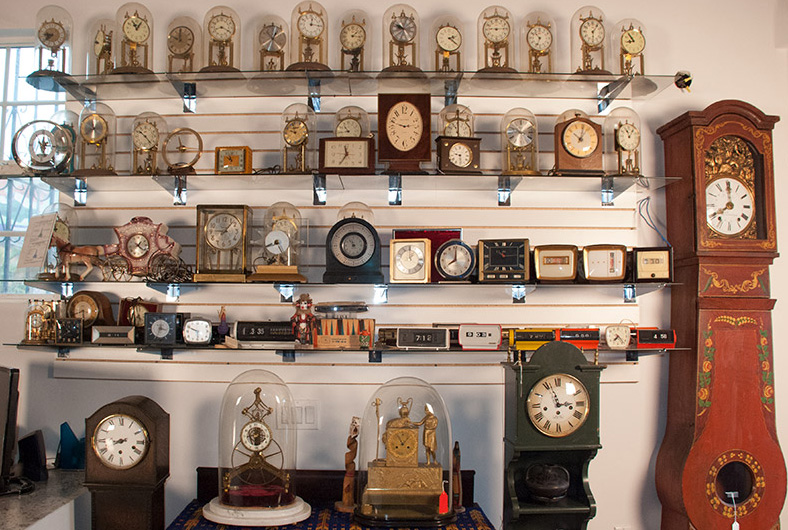
Identify the location of non-analog clock. Image resolution: width=788 pixels, height=530 pixels. (660, 339), (585, 340), (533, 329), (503, 332), (480, 340), (455, 331), (421, 335), (265, 329), (123, 335).